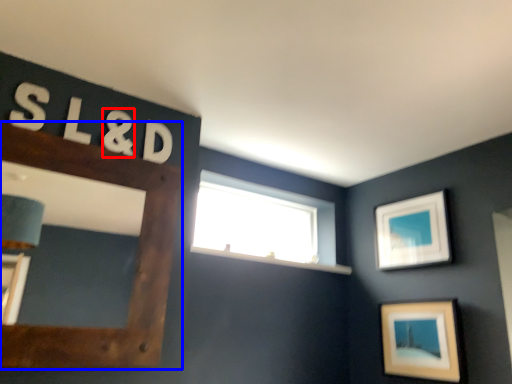
Question: Which point is further to the camera, number (highlighted by a red box) or picture frame (highlighted by a blue box)?

Choices:
 (A) number
 (B) picture frame

Answer: (A)